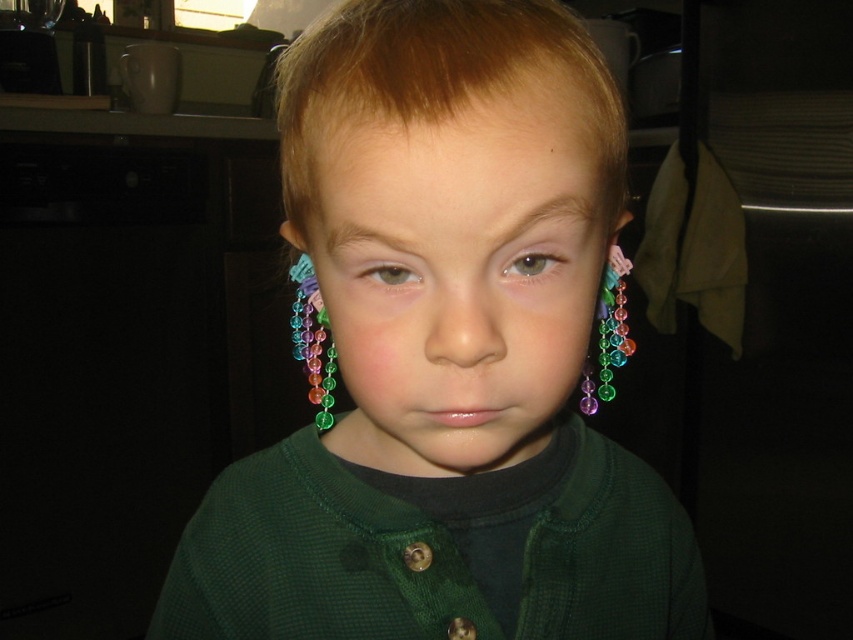
Who is lower down, multicolored beads at right ear or gray matte eye at center?

Positioned lower is multicolored beads at right ear.

Is multicolored beads at right ear to the left of gray matte eye at center from the viewer's perspective?

Incorrect, multicolored beads at right ear is not on the left side of gray matte eye at center.

Does point (604, 372) come farther from viewer compared to point (541, 248)?

Yes, it is behind point (541, 248).

Image resolution: width=853 pixels, height=640 pixels. Identify the location of multicolored beads at right ear. (608, 333).

Does blonde shiny hair at center appear on the left side of gray matte eye at center?

Correct, you'll find blonde shiny hair at center to the left of gray matte eye at center.

Is blonde shiny hair at center positioned behind gray matte eye at center?

No, blonde shiny hair at center is in front of gray matte eye at center.

Between point (354, 99) and point (502, 275), which one is positioned in front?

Point (354, 99)

Find the location of a particular element. This screenshot has width=853, height=640. blonde shiny hair at center is located at coordinates (436, 83).

Can you confirm if green fabric shirt at center is shorter than gray matte eye at center?

In fact, green fabric shirt at center may be taller than gray matte eye at center.

Locate an element on the screen. This screenshot has width=853, height=640. green fabric shirt at center is located at coordinates point(445,356).